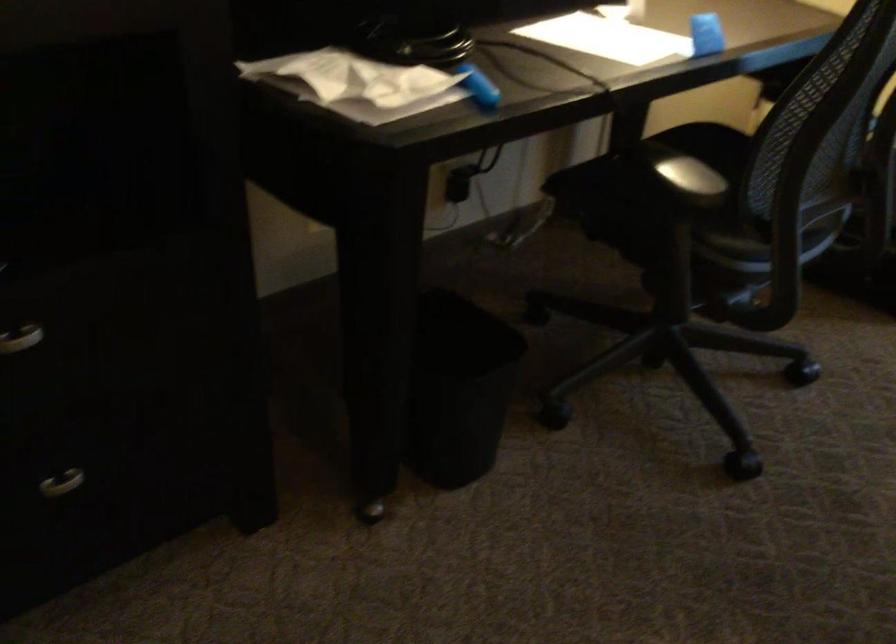
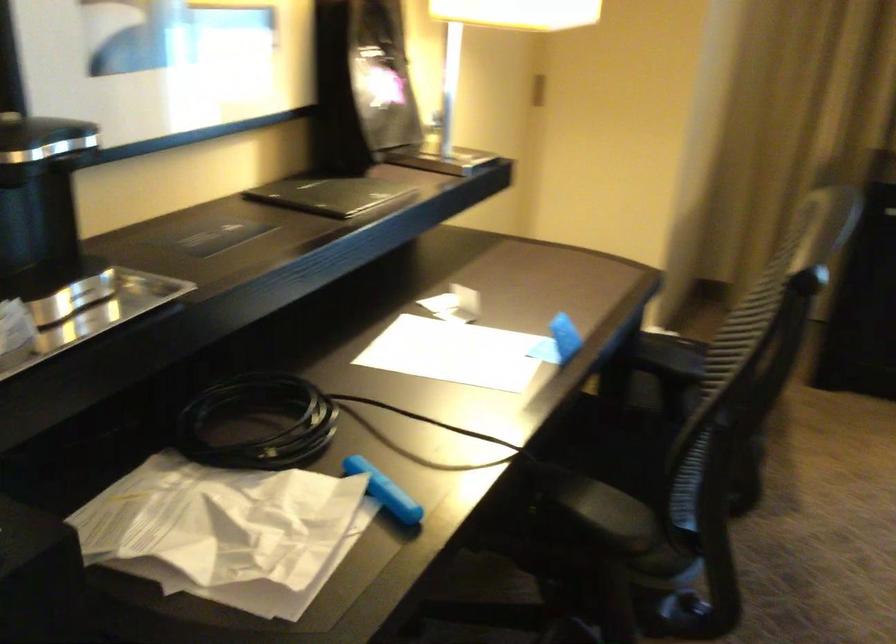
The point at (747, 301) is marked in the first image. Where is the corresponding point in the second image?

(679, 614)